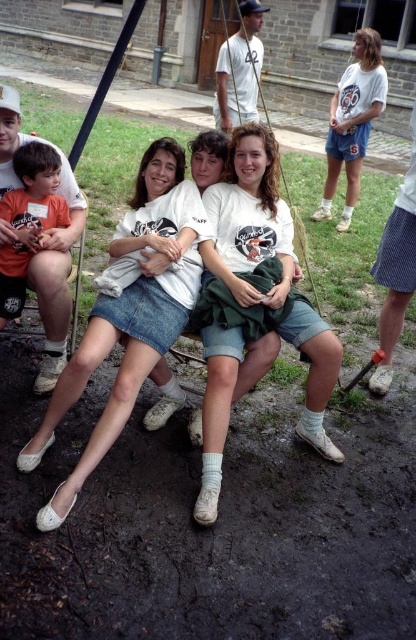
Question: Is white cotton shirt at center wider than orange cotton shirt at left?

Choices:
 (A) no
 (B) yes

Answer: (B)

Question: Which point is farther from the camera taking this photo?

Choices:
 (A) (222, 262)
 (B) (27, 228)

Answer: (B)

Question: Is the position of white cotton shirt at center less distant than that of orange cotton shirt at left?

Choices:
 (A) yes
 (B) no

Answer: (A)

Question: Among these points, which one is farthest from the camera?

Choices:
 (A) click(x=106, y=332)
 (B) click(x=309, y=413)

Answer: (B)

Question: Is denim skirt at center positioned at the back of white cotton shirt at center?

Choices:
 (A) yes
 (B) no

Answer: (B)

Question: Among these points, which one is farthest from the camera?

Choices:
 (A) (203, 246)
 (B) (153, 323)

Answer: (A)